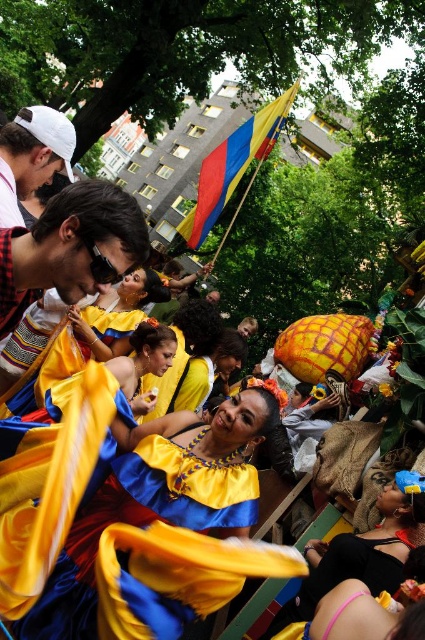
You are a photographer standing at the edge of the parade. You want to capture a clear photo of the shiny satin dress at center. Considering the dress is 32.45 meters away, can you take a clear photo with a standard camera lens that has a maximum focus range of 30 meters?

The shiny satin dress at center is 32.45 meters away from the viewer, which exceeds the standard camera lens maximum focus range of 30 meters. Therefore, you cannot take a clear photo with a standard camera lens.

You are a photographer at the event and want to capture both the shiny satin dress at center and the white matte cap at upper left in a single frame. Which object should you focus on first to ensure both are in the frame?

The shiny satin dress at center is not as tall as the white matte cap at upper left, so you should focus on the white matte cap at upper left first to ensure both are in the frame.